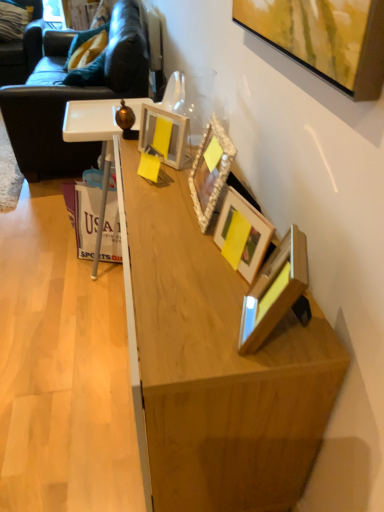
Question: Considering the positions of point (253, 233) and point (112, 92), is point (253, 233) closer or farther from the camera than point (112, 92)?

Choices:
 (A) farther
 (B) closer

Answer: (B)

Question: In terms of height, does wooden picture frame at center, which ranks as the third picture frame in back-to-front order, look taller or shorter compared to dark brown leather couch at left?

Choices:
 (A) short
 (B) tall

Answer: (A)

Question: Which object is positioned farthest from the matte yellow picture frame at center, positioned as the fourth picture frame in front-to-back order?

Choices:
 (A) wooden picture frame at center, which is the 2th picture frame in front-to-back order
 (B) natural wood cabinet at center
 (C) wooden desk at center
 (D) wooden picture frame at lower right, arranged as the 1th picture frame when viewed from the front
 (E) dark brown leather swivel chair at upper left

Answer: (E)

Question: Estimate the real-world distances between objects in this image. Which object is farther from the wooden picture frame at center, which is the 2th picture frame in front-to-back order?

Choices:
 (A) matte yellow picture frame at center, positioned as the fourth picture frame in front-to-back order
 (B) dark brown leather couch at left
 (C) wooden picture frame at lower right, arranged as the 1th picture frame when viewed from the front
 (D) dark brown leather swivel chair at upper left
 (E) wooden desk at center

Answer: (D)